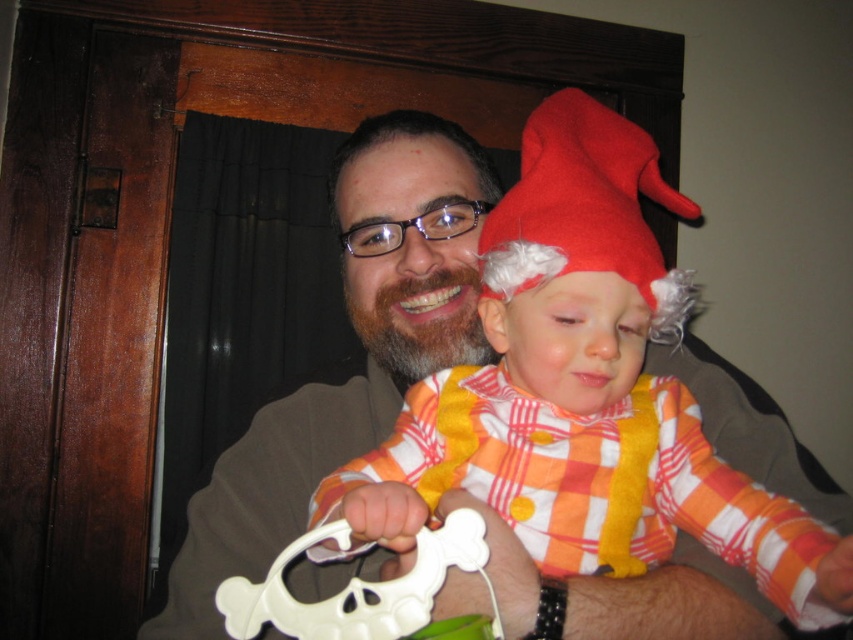
You are a photographer setting up for a family photo. You need to ensure that the white plastic skull at center is visible in the frame without being blocked by the matte brown suit at center. Based on the scene description, is this possible?

The white plastic skull at center is behind the matte brown suit at center, so it would be blocked and not visible in the frame unless the photographer adjusts the position of the subjects or the camera angle to ensure the skull is in front.

You are a photographer setting up for a family portrait. You notice the red felt gnome hat at upper center and the white plastic skull at center. Which object should you adjust to ensure the skull is centered in the frame?

You should move the red felt gnome hat at upper center to the left, as it is currently positioned on the right side of the white plastic skull at center, blocking the center position.